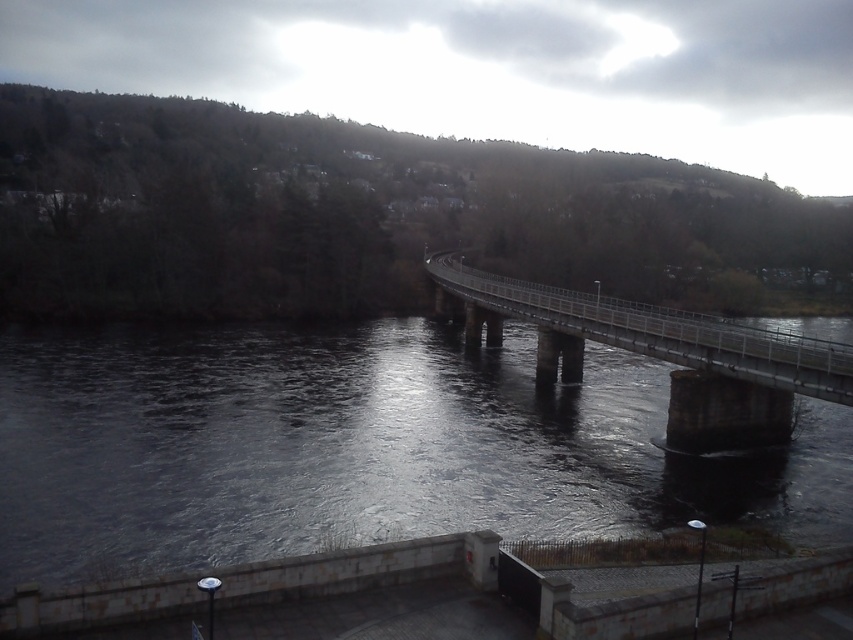
Question: Does dark gray concrete river at center appear under metallic gray bridge at center?

Choices:
 (A) no
 (B) yes

Answer: (B)

Question: Among these points, which one is nearest to the camera?

Choices:
 (A) (605, 342)
 (B) (361, 433)

Answer: (B)

Question: Does dark gray concrete river at center have a smaller size compared to metallic gray bridge at center?

Choices:
 (A) no
 (B) yes

Answer: (B)

Question: Which object appears closest to the camera in this image?

Choices:
 (A) metallic gray bridge at center
 (B) dark gray concrete river at center

Answer: (B)

Question: Does dark gray concrete river at center appear under metallic gray bridge at center?

Choices:
 (A) no
 (B) yes

Answer: (B)